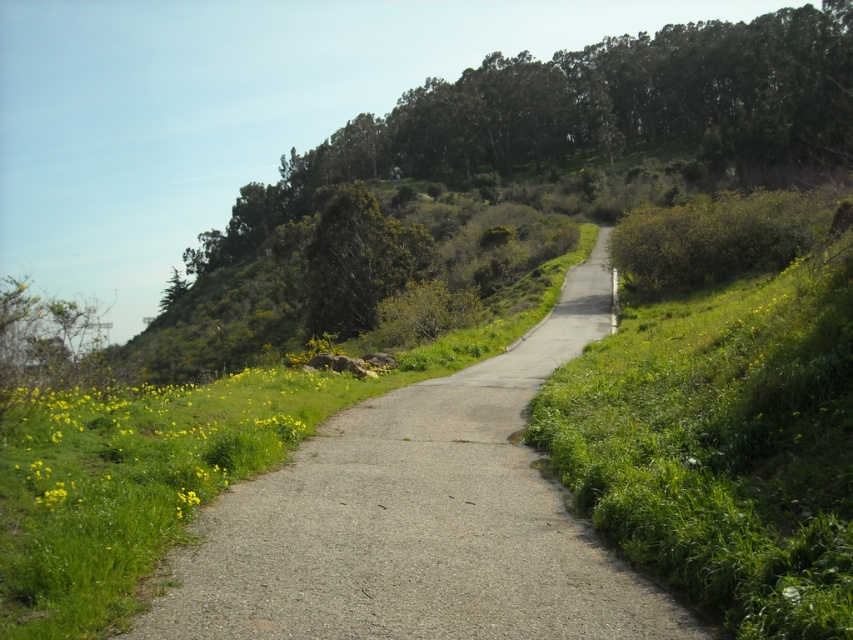
Question: Which of these objects is positioned farthest from the yellow grass at lower left?

Choices:
 (A) gray asphalt path at center
 (B) green textured tree at upper center

Answer: (B)

Question: Can you confirm if gray asphalt path at center is bigger than yellow grass at lower left?

Choices:
 (A) no
 (B) yes

Answer: (B)

Question: Which is farther from the green textured tree at upper center?

Choices:
 (A) gray asphalt path at center
 (B) green leafy tree at upper center
 (C) yellow grass at lower left

Answer: (B)

Question: Which point appears closest to the camera in this image?

Choices:
 (A) 28,438
 (B) 770,131
 (C) 395,483
 (D) 383,289

Answer: (A)

Question: Does gray asphalt path at center appear over green leafy tree at upper center?

Choices:
 (A) yes
 (B) no

Answer: (B)

Question: Can you confirm if gray asphalt path at center is smaller than green leafy tree at upper center?

Choices:
 (A) no
 (B) yes

Answer: (B)